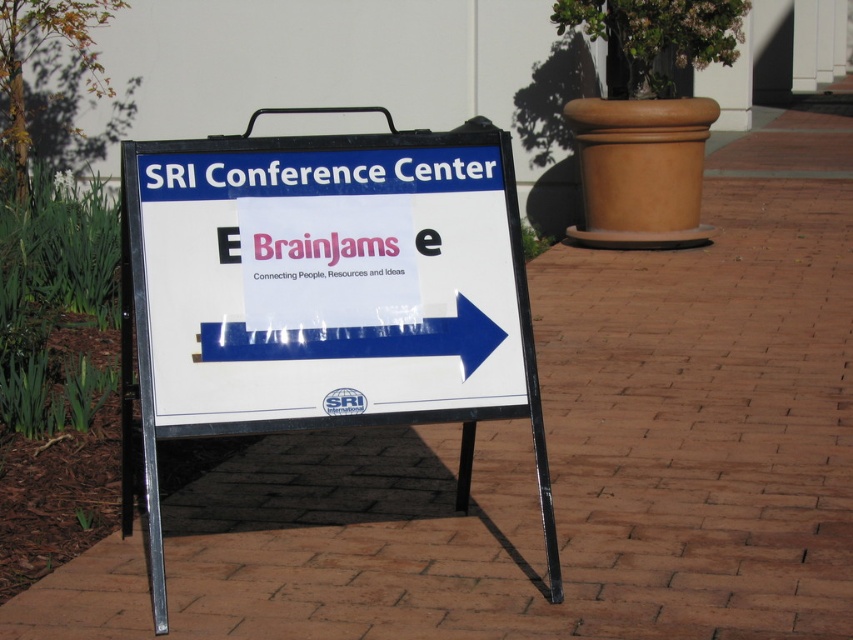
In the scene shown: Who is taller, white plastic sign at center or blue glossy arrow at center?

Standing taller between the two is white plastic sign at center.

Does point (514, 243) lie behind point (468, 368)?

Yes.

Which is in front, point (172, 385) or point (238, 349)?

Point (172, 385) is more forward.

At what (x,y) coordinates should I click in order to perform the action: click on white plastic sign at center. Please return your answer as a coordinate pair (x, y). This screenshot has width=853, height=640. Looking at the image, I should click on (328, 292).